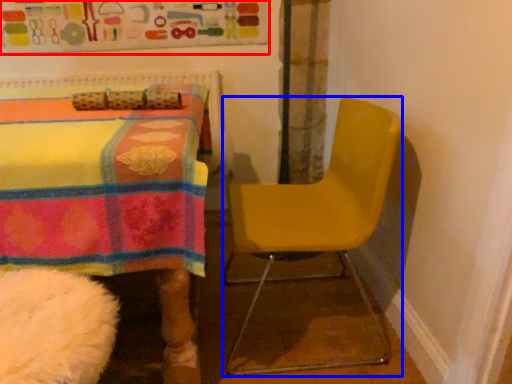
Question: Among these objects, which one is farthest to the camera, bulletin board (highlighted by a red box) or chair (highlighted by a blue box)?

Choices:
 (A) bulletin board
 (B) chair

Answer: (A)